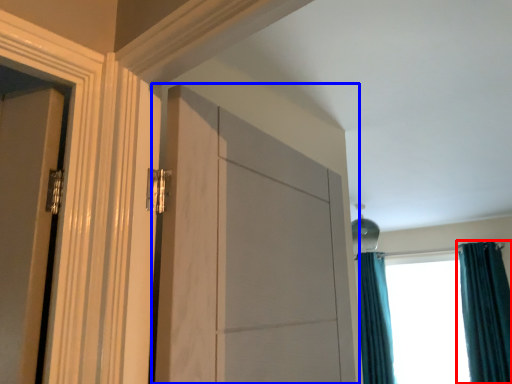
Question: Which object appears farthest to the camera in this image, curtain (highlighted by a red box) or door (highlighted by a blue box)?

Choices:
 (A) curtain
 (B) door

Answer: (A)